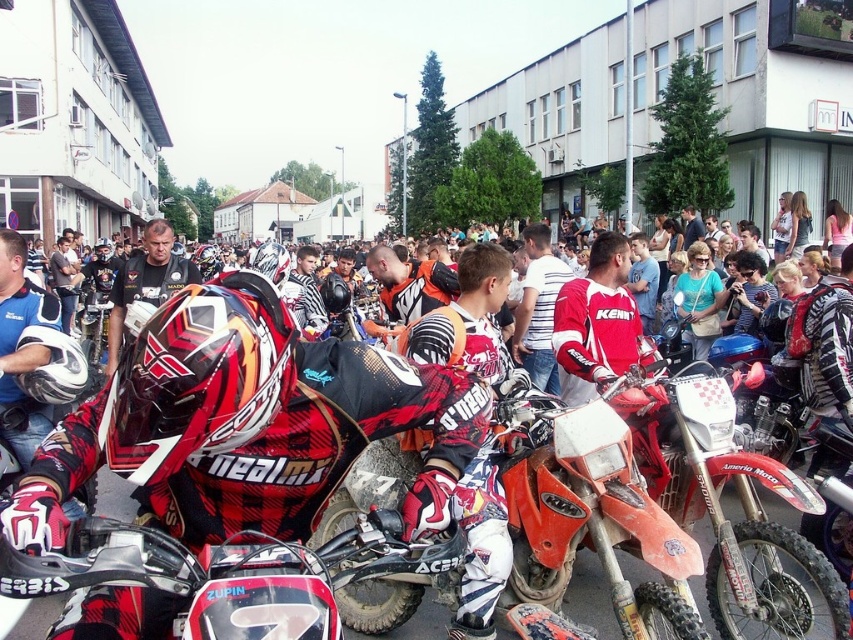
Between red synthetic jacket at center and white striped shirt at center, which one appears on the right side from the viewer's perspective?

red synthetic jacket at center

Who is more distant from viewer, (602, 253) or (531, 275)?

The point (531, 275) is behind.

The height and width of the screenshot is (640, 853). Find the location of `red synthetic jacket at center`. red synthetic jacket at center is located at coordinates (596, 323).

Does point (589, 355) lie in front of point (115, 348)?

Yes.

Is point (572, 397) closer to viewer compared to point (144, 248)?

Yes.

Locate an element on the screen. The image size is (853, 640). red synthetic jacket at center is located at coordinates (596, 323).

Does red and black motocross suit at center have a lesser width compared to white striped shirt at center?

No, red and black motocross suit at center is not thinner than white striped shirt at center.

Locate an element on the screen. red and black motocross suit at center is located at coordinates (250, 426).